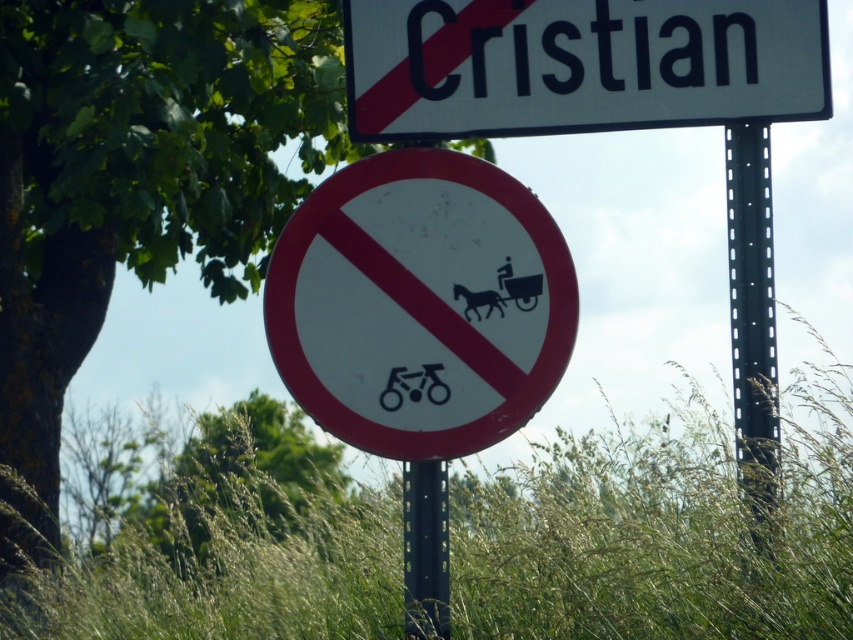
Question: Observing the image, what is the correct spatial positioning of green leafy tree at upper left in reference to white plastic sign at upper center?

Choices:
 (A) right
 (B) left

Answer: (B)

Question: Which object is positioned farthest from the white plastic sign at upper center?

Choices:
 (A) white plastic sign at center
 (B) black matte bicycle at center

Answer: (B)

Question: Is black metal pole at right positioned at the back of black matte bicycle at center?

Choices:
 (A) yes
 (B) no

Answer: (B)

Question: Considering the real-world distances, which object is farthest from the black matte bicycle at center?

Choices:
 (A) green leafy tree at upper left
 (B) black metal pole at right
 (C) white plastic sign at upper center

Answer: (A)

Question: Among these points, which one is farthest from the camera?

Choices:
 (A) (445, 394)
 (B) (102, 182)

Answer: (B)

Question: Does green grass at lower center appear over white plastic sign at upper center?

Choices:
 (A) yes
 (B) no

Answer: (B)